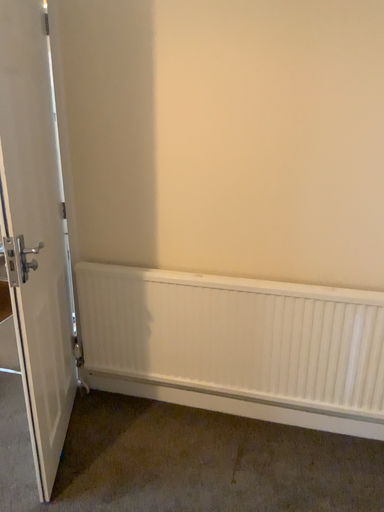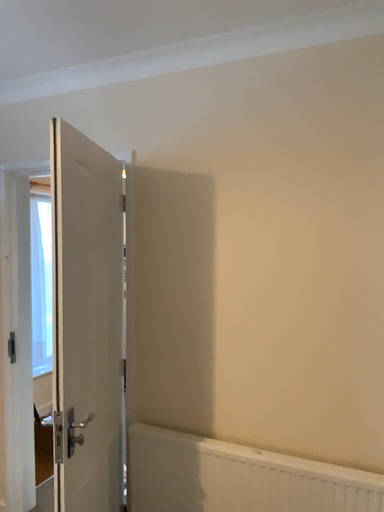
Question: How did the camera likely rotate when shooting the video?

Choices:
 (A) rotated right
 (B) rotated left

Answer: (B)